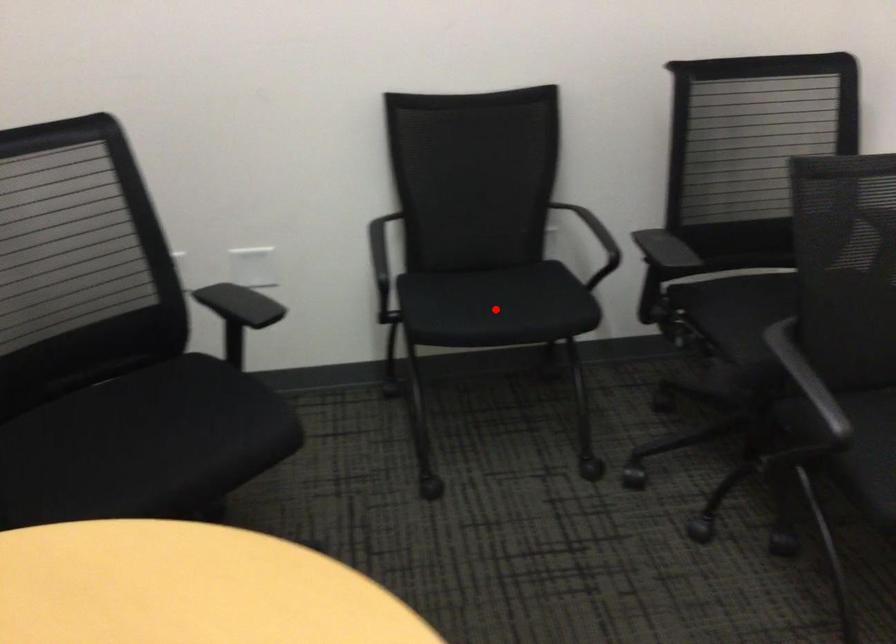
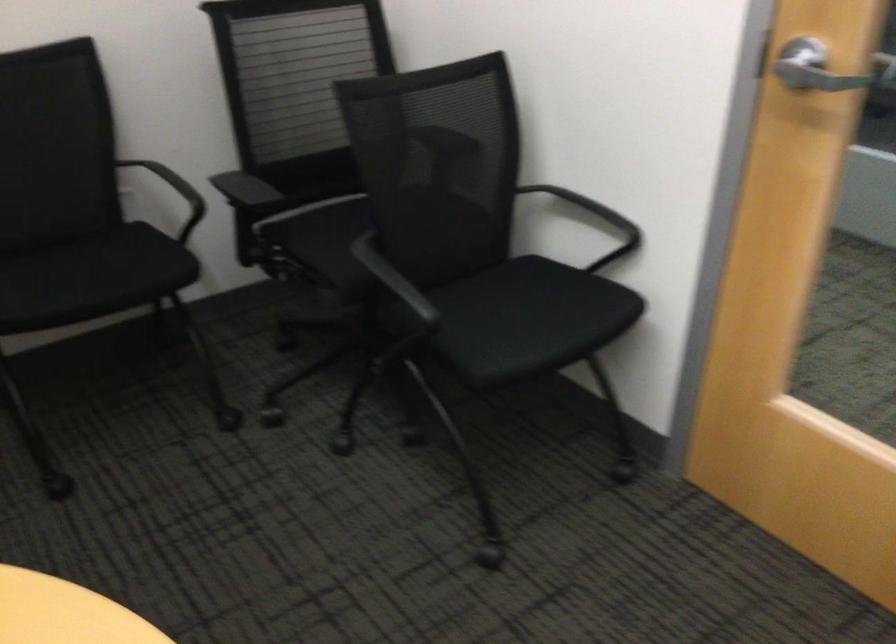
The point at the highlighted location is marked in the first image. Where is the corresponding point in the second image?

(91, 278)